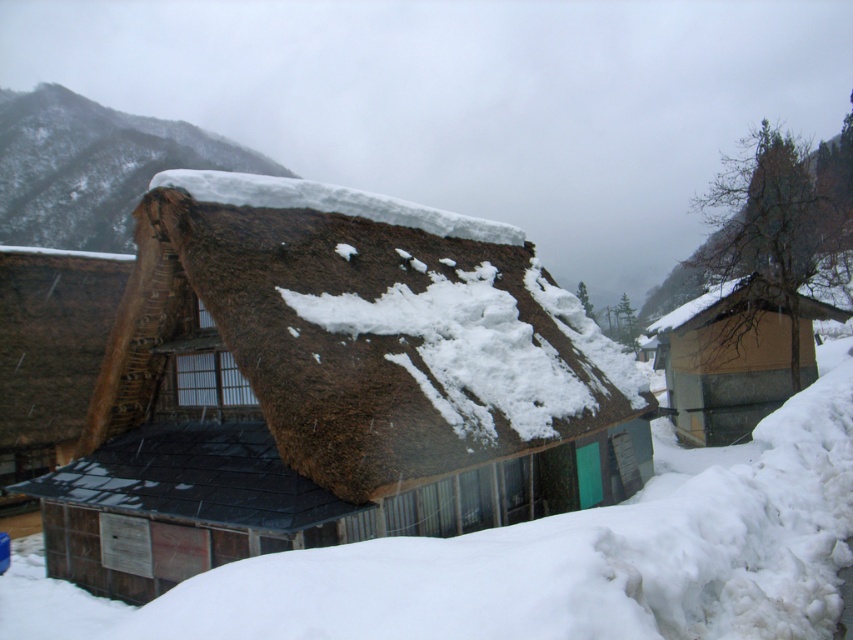
Is bare tree at upper right taller than wooden cabin at right?

Yes.

Does bare tree at upper right have a larger size compared to wooden cabin at right?

Correct, bare tree at upper right is larger in size than wooden cabin at right.

Does point (698, 285) come closer to viewer compared to point (728, 392)?

No, (698, 285) is behind (728, 392).

Where is `bare tree at upper right`? This screenshot has height=640, width=853. bare tree at upper right is located at coordinates (772, 220).

Is point (77, 246) behind point (809, 262)?

Yes, point (77, 246) is behind point (809, 262).

Can you confirm if brown thatch at upper left is positioned to the left of bare tree at upper right?

Correct, you'll find brown thatch at upper left to the left of bare tree at upper right.

Is point (71, 122) farther from viewer compared to point (785, 189)?

Yes.

Find the location of a particular element. brown thatch at upper left is located at coordinates (91, 166).

In the scene shown: Can you confirm if brown thatch hut at center is positioned to the right of bare tree at upper right?

No, brown thatch hut at center is not to the right of bare tree at upper right.

Which of these two, brown thatch hut at center or bare tree at upper right, stands shorter?

Standing shorter between the two is brown thatch hut at center.

Find the location of a particular element. brown thatch hut at center is located at coordinates (329, 387).

The height and width of the screenshot is (640, 853). What are the coordinates of `brown thatch hut at center` in the screenshot? It's located at (329, 387).